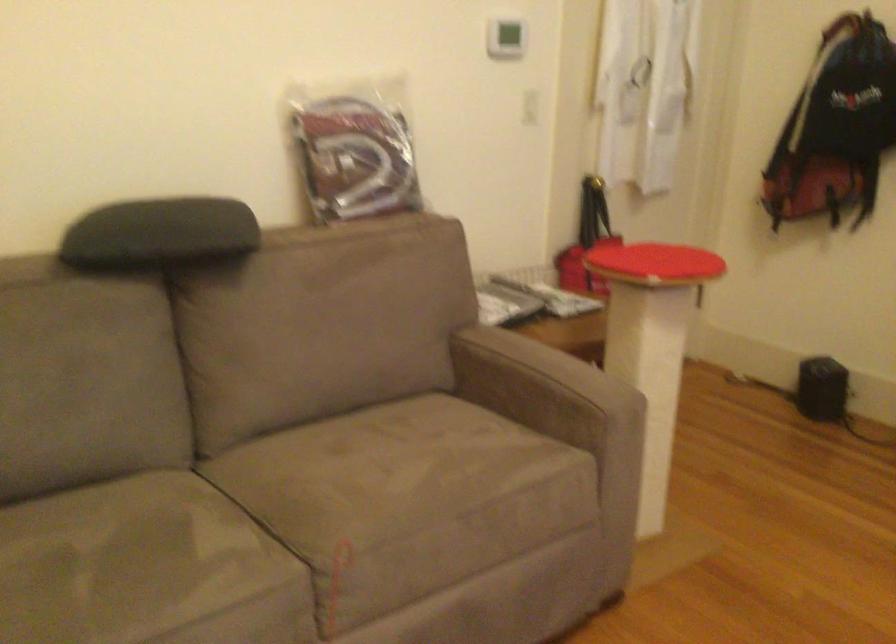
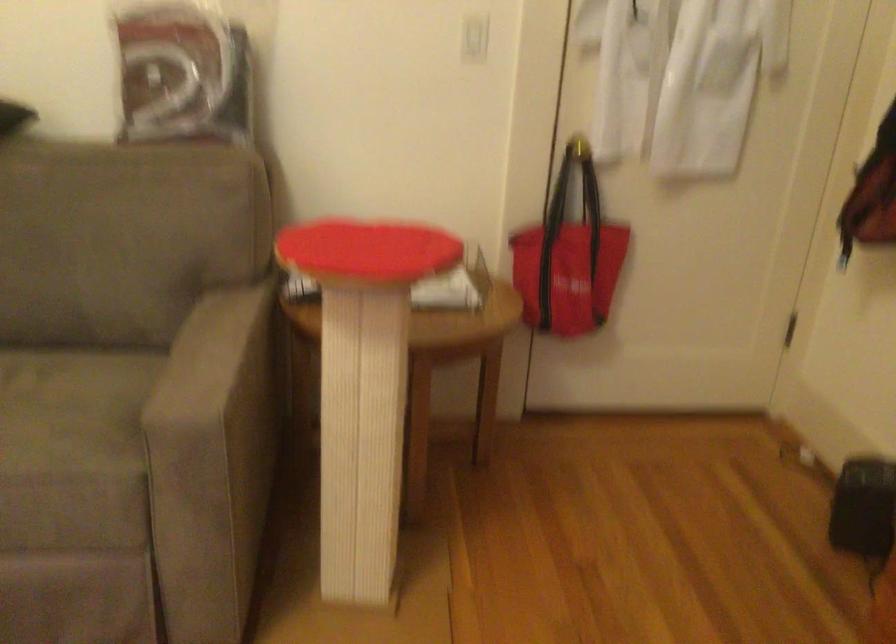
In a continuous first-person perspective shot, in which direction is the camera moving?

The cameraman moved toward right, forward.